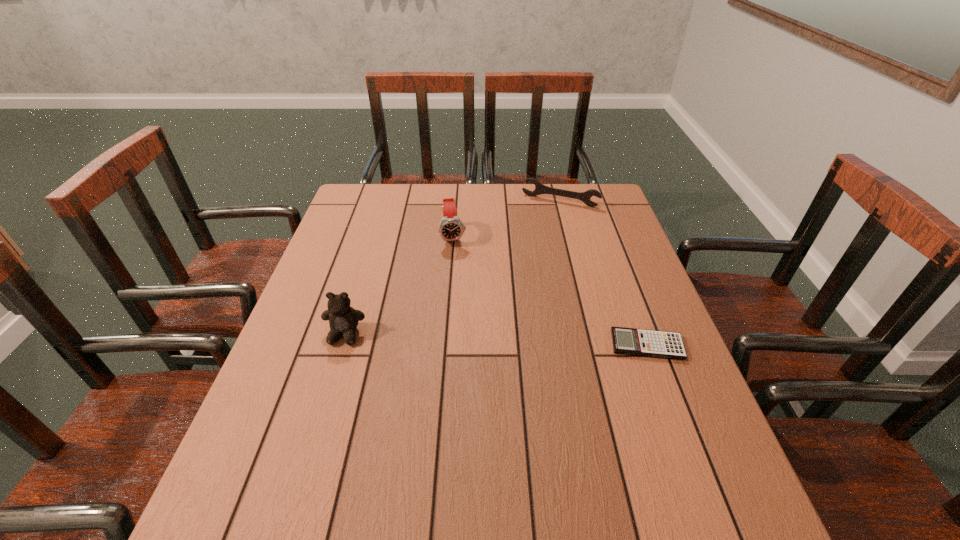
Locate an element on the screen. The height and width of the screenshot is (540, 960). free space on the desktop that is between the leftmost object and the shortest object and is positioned on the open ends of the wrench is located at coordinates (498, 340).

This screenshot has height=540, width=960. I want to click on free space on the desktop that is between the leftmost object and the calculator and is positioned on the face of the third object from right to left, so click(x=467, y=339).